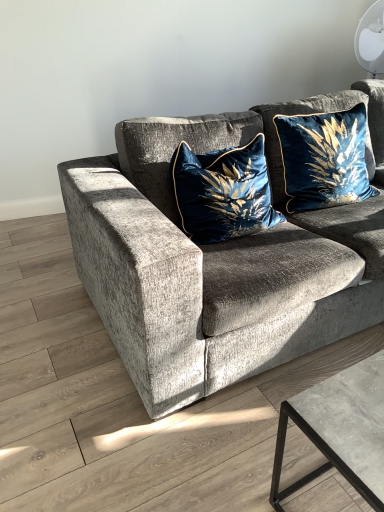
Question: Could you tell me if velvet blue pillow at upper right, the first pillow from the right, is turned towards velvet gray couch at center?

Choices:
 (A) no
 (B) yes

Answer: (B)

Question: Is velvet blue pillow at upper right, the first pillow from the right, at the right side of velvet gray couch at center?

Choices:
 (A) yes
 (B) no

Answer: (B)

Question: From a real-world perspective, is velvet blue pillow at upper right, the first pillow from the right, physically below velvet gray couch at center?

Choices:
 (A) yes
 (B) no

Answer: (B)

Question: From a real-world perspective, is velvet blue pillow at upper right, which ranks as the 2th pillow in left-to-right order, located higher than velvet gray couch at center?

Choices:
 (A) yes
 (B) no

Answer: (A)

Question: Does velvet blue pillow at upper right, the first pillow from the right, appear on the left side of velvet gray couch at center?

Choices:
 (A) yes
 (B) no

Answer: (A)

Question: Looking at their shapes, would you say velvet gray couch at center is wider or thinner than velvet blue pillow at upper right, the first pillow from the right?

Choices:
 (A) wide
 (B) thin

Answer: (A)

Question: Considering the positions of point (114, 309) and point (299, 183), is point (114, 309) closer or farther from the camera than point (299, 183)?

Choices:
 (A) closer
 (B) farther

Answer: (A)

Question: From their relative heights in the image, would you say velvet gray couch at center is taller or shorter than velvet blue pillow at upper right, the first pillow from the right?

Choices:
 (A) tall
 (B) short

Answer: (A)

Question: Based on their positions, is velvet gray couch at center located to the left or right of velvet blue pillow at upper right, which ranks as the 2th pillow in left-to-right order?

Choices:
 (A) left
 (B) right

Answer: (B)

Question: Is velvet gray couch at center spatially inside velvet blue pillow at center, acting as the 1th pillow starting from the left, or outside of it?

Choices:
 (A) inside
 (B) outside

Answer: (B)

Question: From a real-world perspective, relative to velvet blue pillow at center, acting as the 1th pillow starting from the left, is velvet gray couch at center vertically above or below?

Choices:
 (A) above
 (B) below

Answer: (B)

Question: Based on their positions, is velvet gray couch at center located to the left or right of velvet blue pillow at center, acting as the 1th pillow starting from the left?

Choices:
 (A) right
 (B) left

Answer: (A)

Question: Considering the positions of velvet gray couch at center and velvet blue pillow at center, acting as the 2th pillow starting from the right, in the image, is velvet gray couch at center wider or thinner than velvet blue pillow at center, acting as the 2th pillow starting from the right,?

Choices:
 (A) wide
 (B) thin

Answer: (A)

Question: Is velvet blue pillow at upper right, which ranks as the 2th pillow in left-to-right order, inside the boundaries of velvet blue pillow at center, acting as the 1th pillow starting from the left, or outside?

Choices:
 (A) outside
 (B) inside

Answer: (A)

Question: Considering the positions of velvet blue pillow at upper right, the first pillow from the right, and velvet blue pillow at center, acting as the 1th pillow starting from the left, in the image, is velvet blue pillow at upper right, the first pillow from the right, bigger or smaller than velvet blue pillow at center, acting as the 1th pillow starting from the left,?

Choices:
 (A) big
 (B) small

Answer: (B)